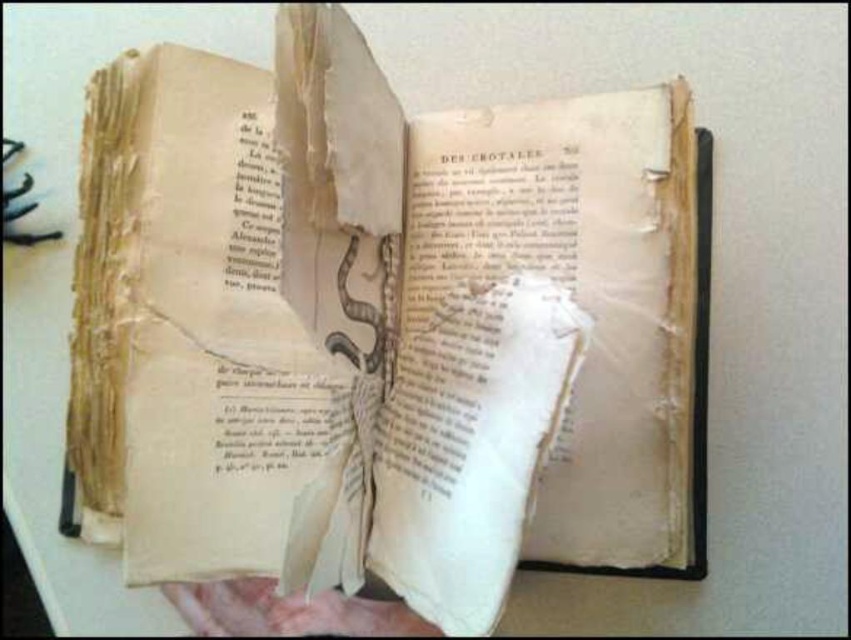
In the scene shown: You are a book conservator examining the yellowed paper book at center and the pink flesh at lower center. Which object takes up more space in the image?

The yellowed paper book at center is bigger than the pink flesh at lower center, so it takes up more space in the image.

You have a small box that is 10 cm wide. You want to place both the yellowed paper book at center and the pink flesh at lower center inside it. Which one should you place first to ensure both fit?

You should place the pink flesh at lower center first because the yellowed paper book at center is wider and needs more space. Since the box is only 10 cm wide, placing the wider item first might help in fitting both, but given the book is larger in width, it might not fit unless the pink flesh is placed first to accommodate the book.

You are an art conservator examining an old book. You notice the yellowed paper book at center and the pink flesh at lower center. Which object is located to the right of the other?

The yellowed paper book at center is positioned on the right side of pink flesh at lower center.